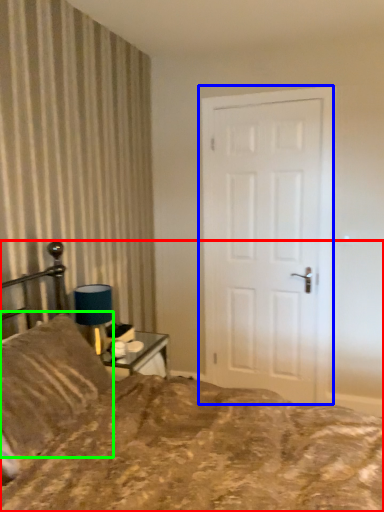
Question: Which is farther away from bed (highlighted by a red box)? door (highlighted by a blue box) or pillow (highlighted by a green box)?

Choices:
 (A) door
 (B) pillow

Answer: (A)